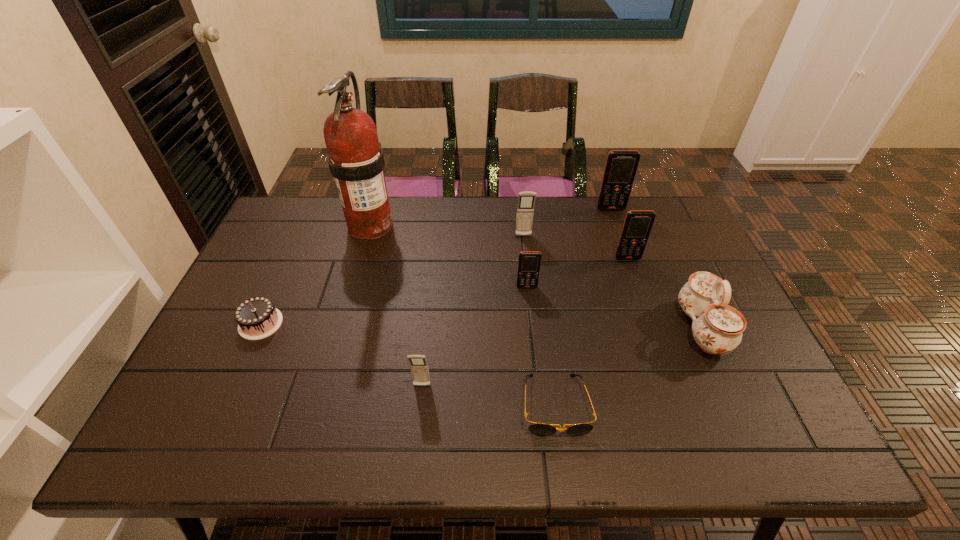
The image size is (960, 540). In order to click on object that is positioned at the left edge in this screenshot , I will do `click(257, 318)`.

I want to click on object at the right edge, so click(717, 328).

Image resolution: width=960 pixels, height=540 pixels. Find the location of `free space at the far edge`. free space at the far edge is located at coordinates (571, 197).

Find the location of a particular element. free space at the near edge is located at coordinates (404, 446).

The height and width of the screenshot is (540, 960). I want to click on vacant region at the left edge of the desktop, so click(279, 276).

The width and height of the screenshot is (960, 540). What are the coordinates of `free space at the right edge` in the screenshot? It's located at click(740, 377).

In the image, there is a desktop. In order to click on vacant area at the far right corner in this screenshot , I will do `click(661, 198)`.

Locate an element on the screen. The width and height of the screenshot is (960, 540). unoccupied area between the eighth shortest object and the smallest orange cellular telephone is located at coordinates (569, 248).

Where is `vacant area that lies between the leftmost object and the farthest cellular telephone`? vacant area that lies between the leftmost object and the farthest cellular telephone is located at coordinates (436, 266).

This screenshot has height=540, width=960. Identify the location of empty space that is in between the fourth farthest cellular telephone and the second object from left to right. click(448, 256).